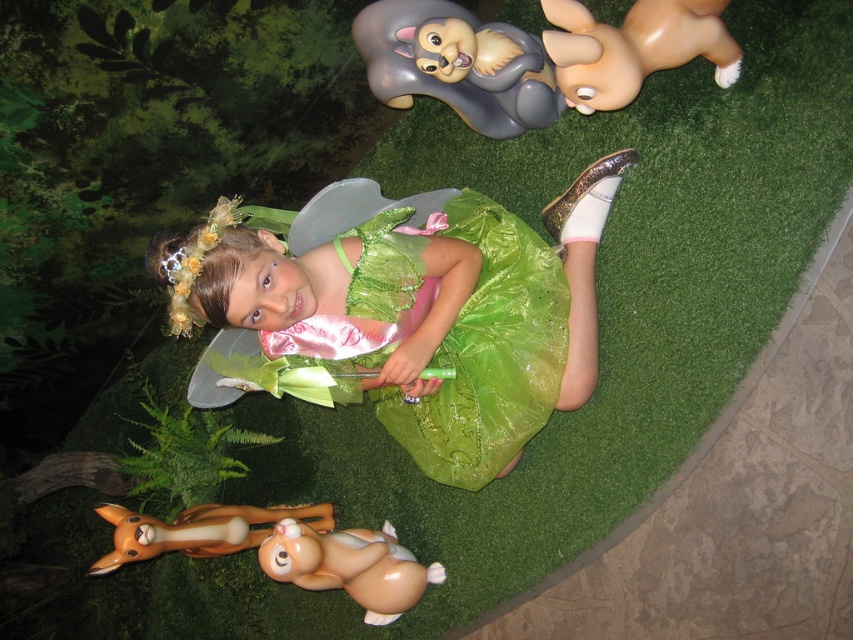
Can you confirm if gray matte squirrel at upper center is smaller than brown matte rabbit at upper center?

No, gray matte squirrel at upper center is not smaller than brown matte rabbit at upper center.

Based on the photo, between gray matte squirrel at upper center and brown matte rabbit at upper center, which one is positioned lower?

brown matte rabbit at upper center

Between point (525, 52) and point (606, 24), which one is positioned behind?

The point (525, 52) is more distant.

This screenshot has height=640, width=853. Find the location of `gray matte squirrel at upper center`. gray matte squirrel at upper center is located at coordinates (457, 65).

Which is behind, point (486, 86) or point (339, 540)?

The point (339, 540) is more distant.

Find the location of `gray matte squirrel at upper center`. gray matte squirrel at upper center is located at coordinates (457, 65).

Which is in front, point (569, 49) or point (233, 547)?

Point (569, 49) is in front.

Who is shorter, brown matte rabbit at upper center or brown matte/soft toy at lower left?

Standing shorter between the two is brown matte/soft toy at lower left.

Image resolution: width=853 pixels, height=640 pixels. In order to click on brown matte rabbit at upper center in this screenshot , I will do `click(633, 48)`.

This screenshot has height=640, width=853. What are the coordinates of `brown matte rabbit at upper center` in the screenshot? It's located at (633, 48).